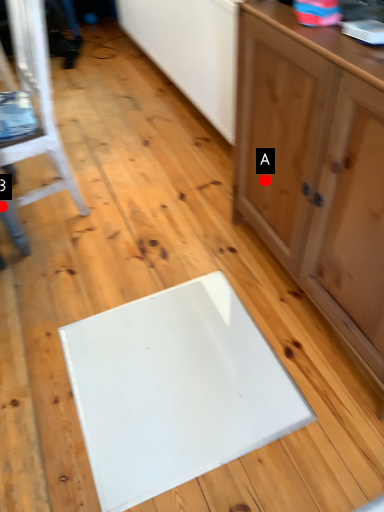
Question: Two points are circled on the image, labeled by A and B beside each circle. Which point is further to the camera?

Choices:
 (A) A is further
 (B) B is further

Answer: (B)